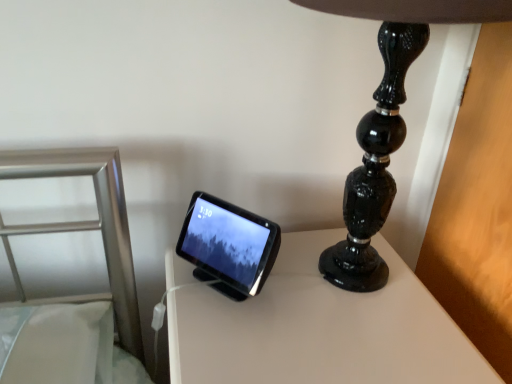
Question: Should I look upward or downward to see white glossy table at center?

Choices:
 (A) up
 (B) down

Answer: (B)

Question: Does matte black tablet at center lie behind white glossy table at center?

Choices:
 (A) no
 (B) yes

Answer: (B)

Question: Considering the relative positions of matte black tablet at center and white glossy table at center in the image provided, is matte black tablet at center to the right of white glossy table at center from the viewer's perspective?

Choices:
 (A) no
 (B) yes

Answer: (A)

Question: Is matte black tablet at center shorter than white glossy table at center?

Choices:
 (A) no
 (B) yes

Answer: (B)

Question: Is the position of matte black tablet at center less distant than that of white glossy table at center?

Choices:
 (A) no
 (B) yes

Answer: (A)

Question: From a real-world perspective, is matte black tablet at center physically above white glossy table at center?

Choices:
 (A) yes
 (B) no

Answer: (A)

Question: From a real-world perspective, is matte black tablet at center positioned under white glossy table at center based on gravity?

Choices:
 (A) no
 (B) yes

Answer: (A)

Question: From a real-world perspective, is black glossy lamp at upper right over matte black tablet at center?

Choices:
 (A) yes
 (B) no

Answer: (A)

Question: From the image's perspective, would you say black glossy lamp at upper right is shown under matte black tablet at center?

Choices:
 (A) no
 (B) yes

Answer: (A)

Question: Can you confirm if black glossy lamp at upper right is wider than matte black tablet at center?

Choices:
 (A) no
 (B) yes

Answer: (B)

Question: Is black glossy lamp at upper right outside matte black tablet at center?

Choices:
 (A) no
 (B) yes

Answer: (B)

Question: Does black glossy lamp at upper right have a larger size compared to matte black tablet at center?

Choices:
 (A) yes
 (B) no

Answer: (A)

Question: Does black glossy lamp at upper right come behind matte black tablet at center?

Choices:
 (A) yes
 (B) no

Answer: (B)

Question: Is white glossy table at center next to black glossy lamp at upper right and touching it?

Choices:
 (A) no
 (B) yes

Answer: (A)